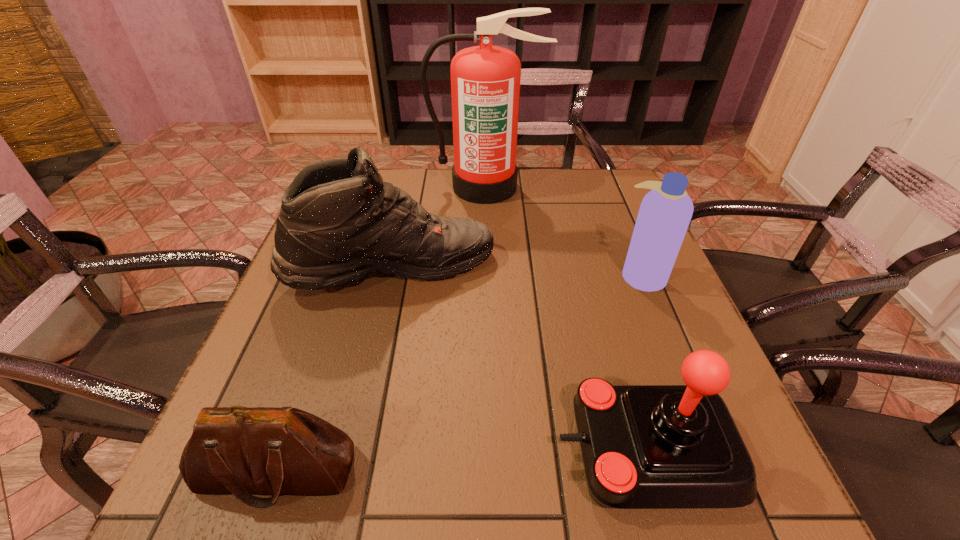
This screenshot has width=960, height=540. What are the coordinates of `the tallest object` in the screenshot? It's located at (485, 80).

Where is `the farthest object`? the farthest object is located at coordinates (485, 80).

You are a GUI agent. You are given a task and a screenshot of the screen. Output one action in this format:
    pyautogui.click(x=<x>, y=<y>)
    Task: Click on the ski boot
    Image resolution: width=960 pixels, height=540 pixels.
    Given the screenshot: What is the action you would take?
    pyautogui.click(x=339, y=222)

Where is `shampoo`? The height and width of the screenshot is (540, 960). shampoo is located at coordinates (665, 212).

Locate an element on the screen. This screenshot has width=960, height=540. joystick is located at coordinates (643, 446).

Where is `shoulder bag`? The width and height of the screenshot is (960, 540). shoulder bag is located at coordinates (236, 450).

Identify the location of vacant space located at the nozzle of the fire extinguisher. (487, 262).

Identify the location of free space located on the front of the ski boot. pyautogui.click(x=376, y=342).

At what (x,y) coordinates should I click in order to perform the action: click on free region located on the front of the shampoo. Please return your answer as a coordinate pair (x, y). Looking at the image, I should click on (700, 419).

Image resolution: width=960 pixels, height=540 pixels. Identify the location of free location located on the base of the joystick. coord(311,450).